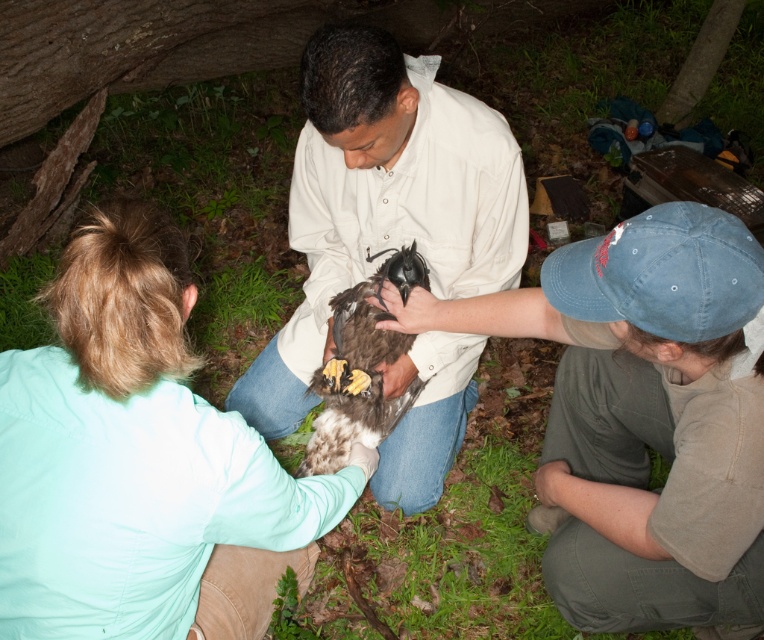
Between smooth beige shirt at center and brown speckled feathers at center, which one appears on the left side from the viewer's perspective?

smooth beige shirt at center is more to the left.

Can you confirm if smooth beige shirt at center is smaller than brown speckled feathers at center?

Incorrect, smooth beige shirt at center is not smaller in size than brown speckled feathers at center.

Locate an element on the screen. smooth beige shirt at center is located at coordinates (384, 198).

Locate an element on the screen. This screenshot has width=764, height=640. smooth beige shirt at center is located at coordinates (384, 198).

Who is positioned more to the left, light blue shirt at center or brown speckled feathers at center?

Positioned to the left is light blue shirt at center.

Can you confirm if light blue shirt at center is smaller than brown speckled feathers at center?

No, light blue shirt at center is not smaller than brown speckled feathers at center.

Describe the element at coordinates (141, 461) in the screenshot. The height and width of the screenshot is (640, 764). I see `light blue shirt at center` at that location.

This screenshot has width=764, height=640. Find the location of `light blue shirt at center`. light blue shirt at center is located at coordinates (141, 461).

Does light blue shirt at center have a greater width compared to brown feathered hawk at center?

In fact, light blue shirt at center might be narrower than brown feathered hawk at center.

Is the position of light blue shirt at center less distant than that of brown feathered hawk at center?

Yes, it is in front of brown feathered hawk at center.

Which is in front, point (2, 353) or point (447, 330)?

Point (2, 353) is in front.

What are the coordinates of `light blue shirt at center` in the screenshot? It's located at (141, 461).